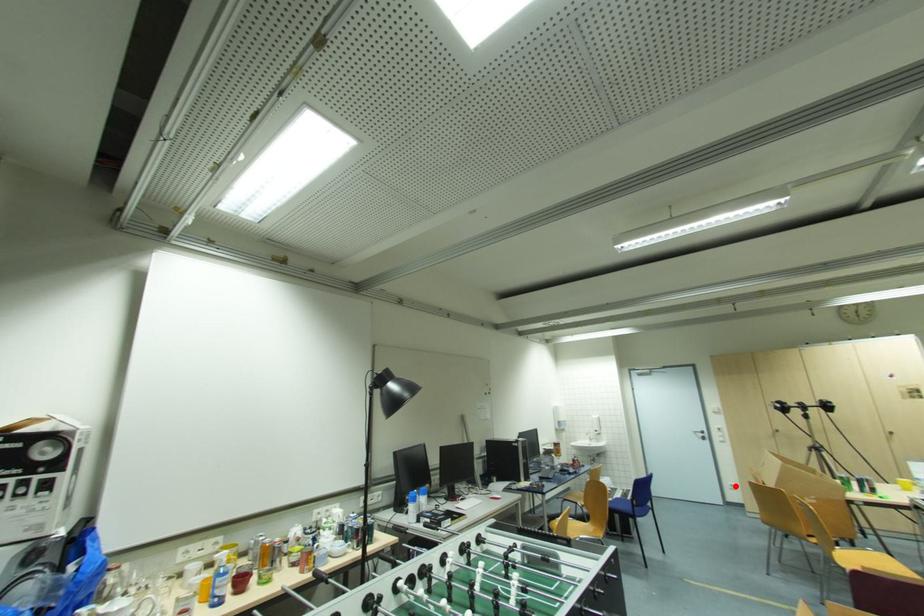
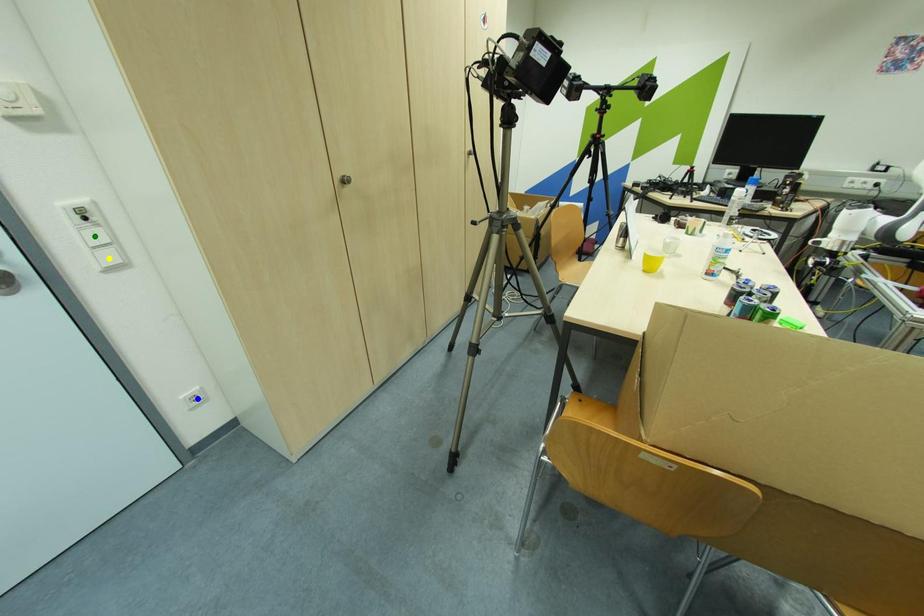
Question: I am providing you with two images of the same scene from different viewpoints. A red point is marked on the first image. You are given multiple points on the second image. Can you choose the point in image 2 that corresponds to the point in image 1?

Choices:
 (A) blue point
 (B) yellow point
 (C) green point

Answer: (A)